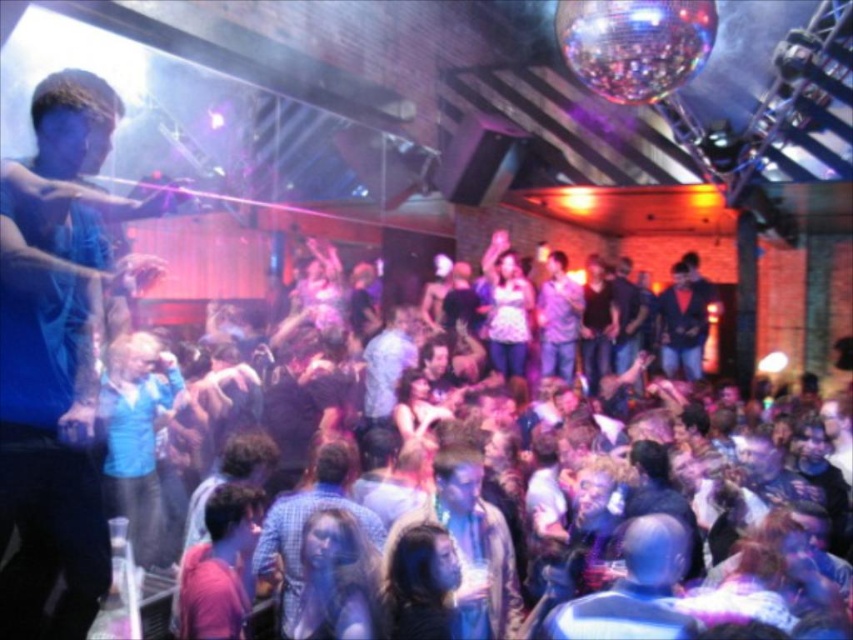
Does blue matte shirt at center have a smaller size compared to shiny blue suit at center?

Indeed, blue matte shirt at center has a smaller size compared to shiny blue suit at center.

Is point (109, 397) positioned after point (688, 362)?

No.

This screenshot has height=640, width=853. I want to click on blue matte shirt at center, so click(x=136, y=433).

The image size is (853, 640). What do you see at coordinates (219, 564) in the screenshot?
I see `light brown hair at center` at bounding box center [219, 564].

Locate an element on the screen. Image resolution: width=853 pixels, height=640 pixels. light brown hair at center is located at coordinates (219, 564).

At what (x,y) coordinates should I click in order to perform the action: click on light brown hair at center. Please return your answer as a coordinate pair (x, y). Looking at the image, I should click on (219, 564).

Can you confirm if light brown leather jacket at center is positioned to the left of dark blue jeans at center?

Indeed, light brown leather jacket at center is positioned on the left side of dark blue jeans at center.

What do you see at coordinates (469, 544) in the screenshot? I see `light brown leather jacket at center` at bounding box center [469, 544].

Locate an element on the screen. The height and width of the screenshot is (640, 853). light brown leather jacket at center is located at coordinates (469, 544).